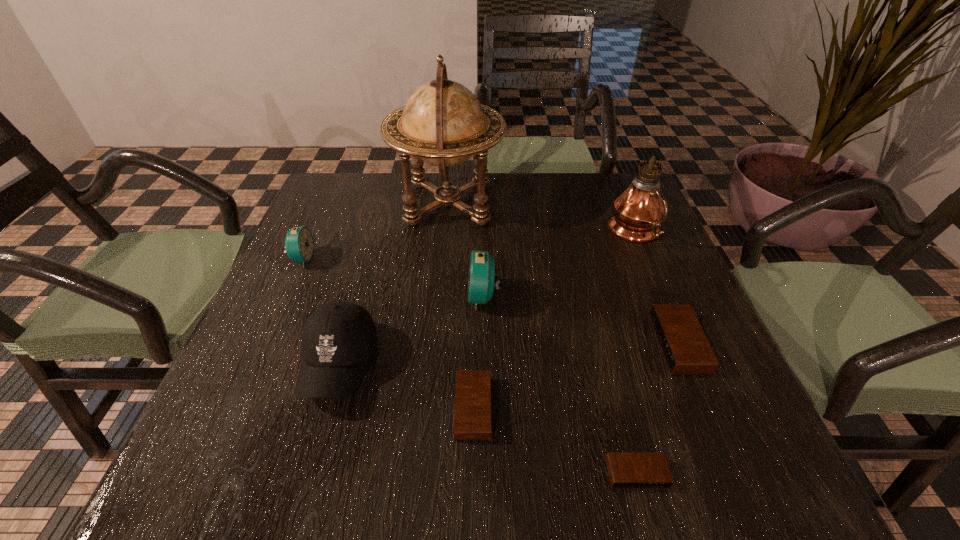
The width and height of the screenshot is (960, 540). What are the coordinates of `the second biggest black alarm clock` in the screenshot? It's located at (472, 416).

What are the coordinates of `the second black alarm clock from right to left` in the screenshot? It's located at (626, 470).

At what (x,y) coordinates should I click in order to perform the action: click on the shortest object. Please return your answer as a coordinate pair (x, y). The width and height of the screenshot is (960, 540). Looking at the image, I should click on (626, 470).

At what (x,y) coordinates should I click in order to perform the action: click on free space located 0.220m on the front-facing side of the globe. Please return your answer as a coordinate pair (x, y). The image size is (960, 540). Looking at the image, I should click on (583, 202).

Identify the location of free space located on the back of the oil lamp. The width and height of the screenshot is (960, 540). (610, 172).

What are the coordinates of `vacant space located 0.070m on the front-facing side of the bigger blue alarm clock` in the screenshot? It's located at (435, 297).

You are a GUI agent. You are given a task and a screenshot of the screen. Output one action in this format:
    pyautogui.click(x=<x>, y=<y>)
    Task: Click on the vacant space located on the front-facing side of the bigger blue alarm clock
    The height and width of the screenshot is (540, 960).
    Given the screenshot: What is the action you would take?
    pyautogui.click(x=417, y=297)

Find the location of a particular element. This screenshot has width=960, height=540. free spot located 0.180m on the front-facing side of the bigger blue alarm clock is located at coordinates (384, 297).

Where is `vacant position located on the front-facing side of the baseball cap`? The width and height of the screenshot is (960, 540). vacant position located on the front-facing side of the baseball cap is located at coordinates (312, 462).

Locate an element on the screen. The width and height of the screenshot is (960, 540). vacant space situated 0.260m on the front-facing side of the fourth shortest object is located at coordinates (423, 259).